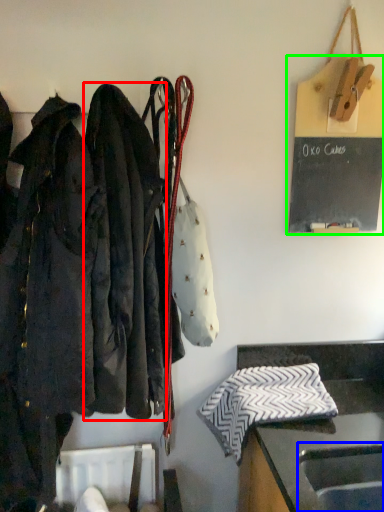
Question: Which object is positioned farthest from jacket (highlighted by a red box)? Select from sink (highlighted by a blue box) and bulletin board (highlighted by a green box).

Choices:
 (A) sink
 (B) bulletin board

Answer: (A)